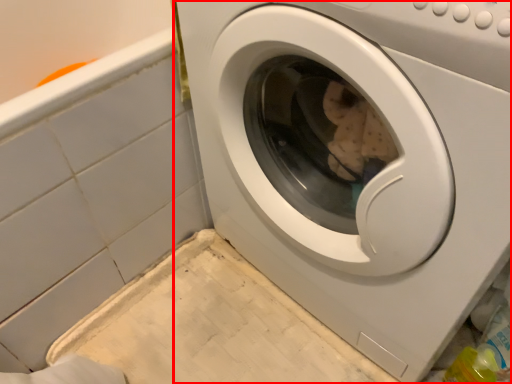
Question: From the image's perspective, considering the relative positions of washing machine (annotated by the red box) and bath in the image provided, where is washing machine (annotated by the red box) located with respect to the staircase?

Choices:
 (A) above
 (B) below

Answer: (B)